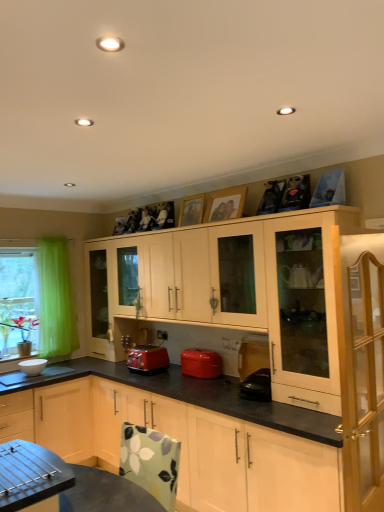
Locate an element on the screen. The width and height of the screenshot is (384, 512). free point in front of matte red toaster at center, the first kitchen appliance from the left is located at coordinates (158, 377).